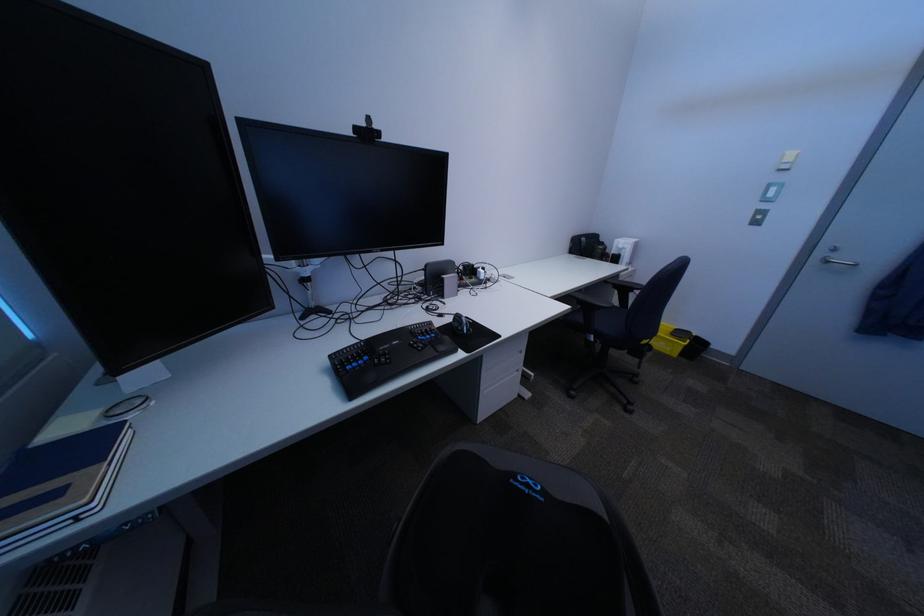
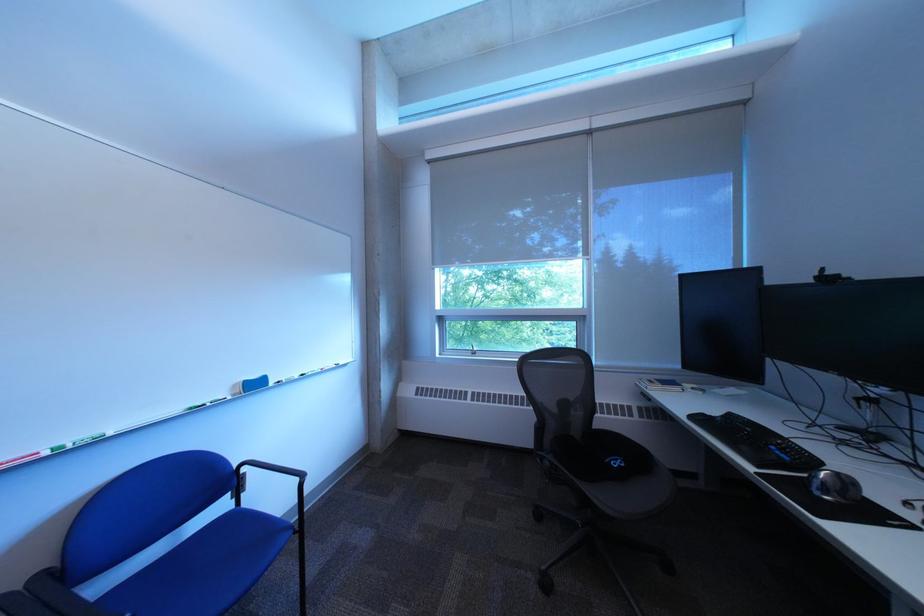
Where in the second image is the point corresponding to pixel 390 128 from the first image?

(843, 275)